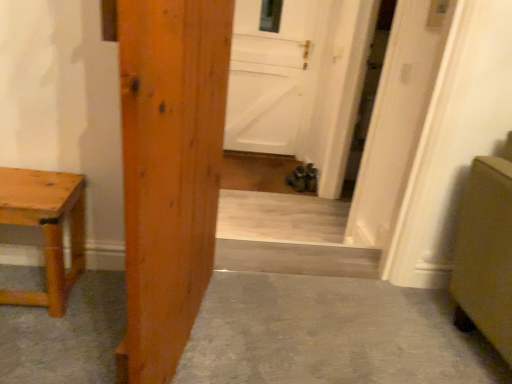
Locate an element on the screen. The height and width of the screenshot is (384, 512). vacant position to the left of wooden door at center, which ranks as the first door in front-to-back order is located at coordinates (78, 327).